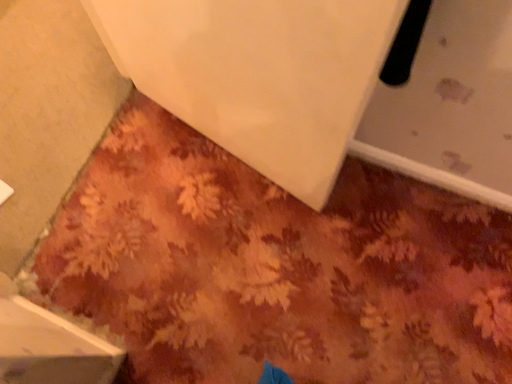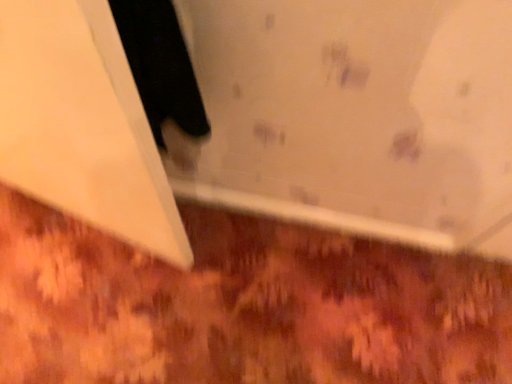
Question: Which way did the camera rotate in the video?

Choices:
 (A) rotated right
 (B) rotated left

Answer: (A)